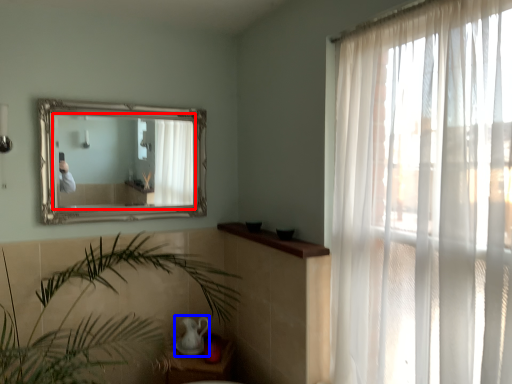
Question: Among these objects, which one is nearest to the camera, mirror (highlighted by a red box) or tea pot (highlighted by a blue box)?

Choices:
 (A) mirror
 (B) tea pot

Answer: (A)